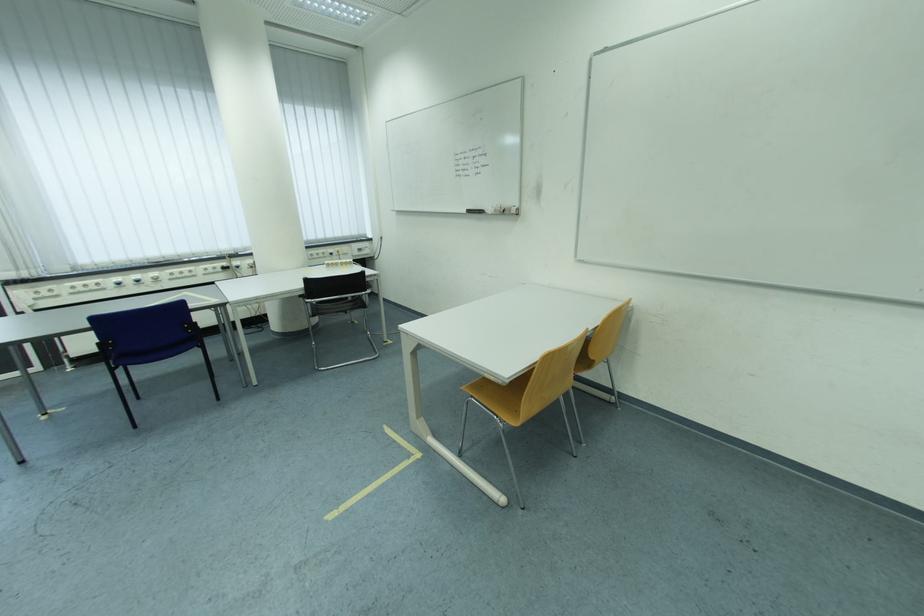
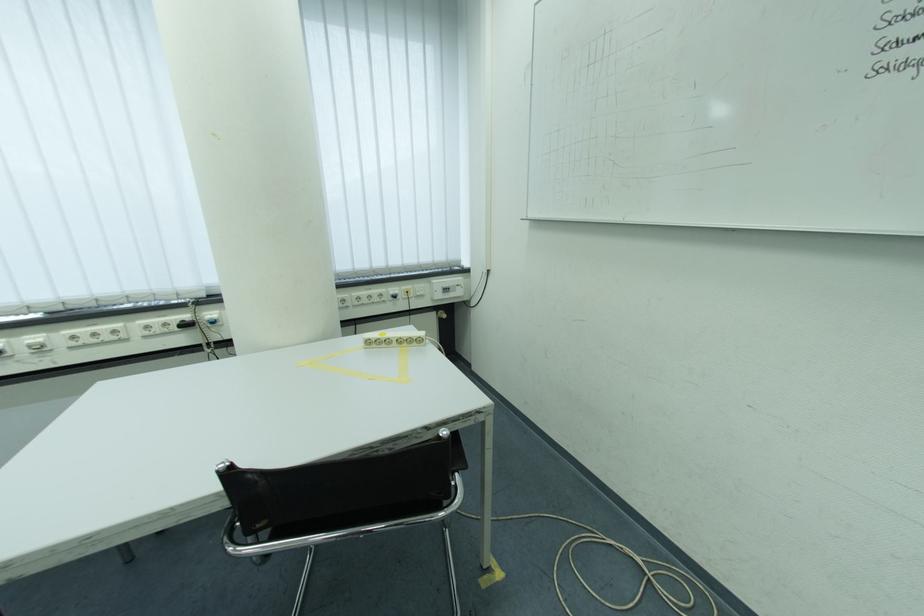
Where in the second image is the point corresponding to (339,253) from the first image?

(402, 291)